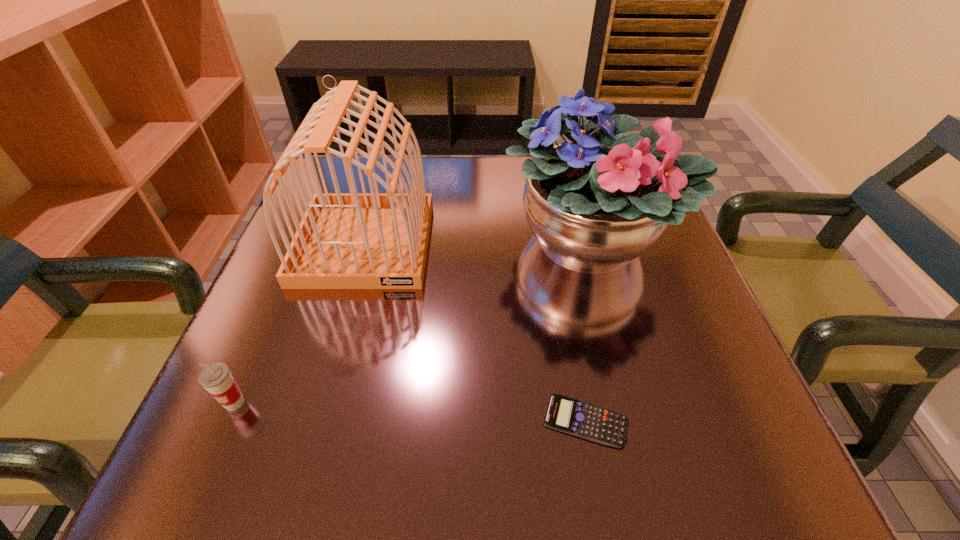
Locate an element on the screen. This screenshot has width=960, height=540. vacant area at the far left corner is located at coordinates (381, 178).

In the image, there is a desktop. In order to click on free region at the near right corner in this screenshot , I will do `click(671, 469)`.

Where is `vacant space that is in between the shortest object and the birdcage`? This screenshot has width=960, height=540. vacant space that is in between the shortest object and the birdcage is located at coordinates (475, 332).

Image resolution: width=960 pixels, height=540 pixels. Identify the location of vacant space that's between the third shortest object and the birdcage. (477, 243).

The height and width of the screenshot is (540, 960). Find the location of `vacant space that is in between the cup and the calculator`. vacant space that is in between the cup and the calculator is located at coordinates (410, 411).

At what (x,y) coordinates should I click in order to perform the action: click on empty space between the third tallest object and the birdcage. Please return your answer as a coordinate pair (x, y). Image resolution: width=960 pixels, height=540 pixels. Looking at the image, I should click on (300, 323).

At what (x,y) coordinates should I click in order to perform the action: click on free space that is in between the birdcage and the second tallest object. Please return your answer as a coordinate pair (x, y). Looking at the image, I should click on (477, 243).

Locate an element on the screen. vacant area that lies between the third shortest object and the birdcage is located at coordinates (477, 243).

Where is `free space between the birdcage and the cup`? free space between the birdcage and the cup is located at coordinates (300, 323).

At what (x,y) coordinates should I click in order to perform the action: click on free space between the third shortest object and the birdcage. Please return your answer as a coordinate pair (x, y). Looking at the image, I should click on (477, 243).